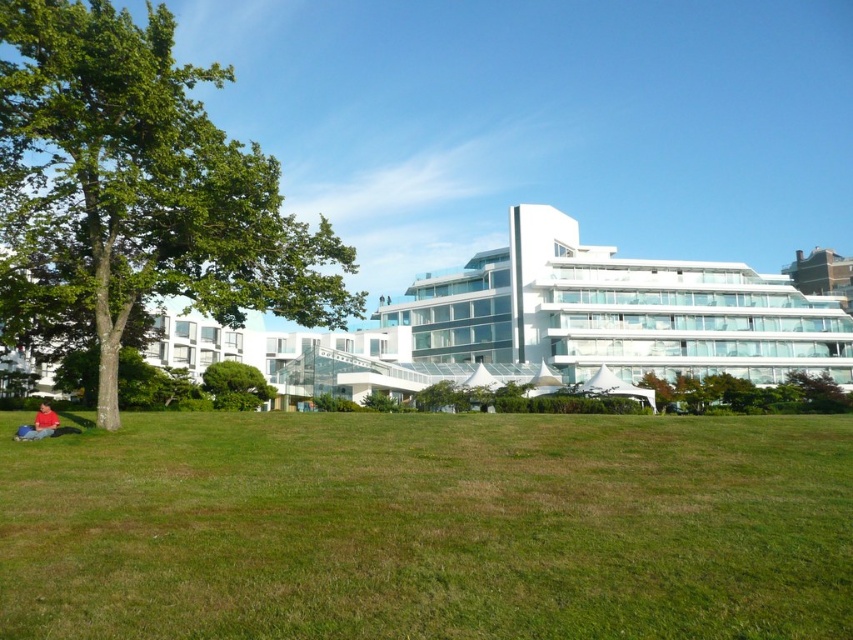
Is point (248, 628) positioned in front of point (45, 433)?

Yes, point (248, 628) is in front of point (45, 433).

Can you confirm if green grassy field at lower center is positioned below red cotton shirt at lower left?

No.

Who is more forward, (610, 488) or (42, 410)?

Point (610, 488)

Where is `green grassy field at lower center`? green grassy field at lower center is located at coordinates (428, 528).

In the scene shown: Does white glass building at center have a greater width compared to green leafy tree at center?

Indeed, white glass building at center has a greater width compared to green leafy tree at center.

Identify the location of white glass building at center. (618, 312).

Who is positioned more to the right, green leafy tree at center or red cotton shirt at lower left?

green leafy tree at center

Can you confirm if green leafy tree at center is smaller than red cotton shirt at lower left?

Yes, green leafy tree at center is smaller than red cotton shirt at lower left.

Describe the element at coordinates (236, 385) in the screenshot. I see `green leafy tree at center` at that location.

You are a GUI agent. You are given a task and a screenshot of the screen. Output one action in this format:
    pyautogui.click(x=<x>, y=<y>)
    Task: Click on the green leafy tree at center
    The image size is (853, 640).
    Given the screenshot: What is the action you would take?
    pyautogui.click(x=236, y=385)